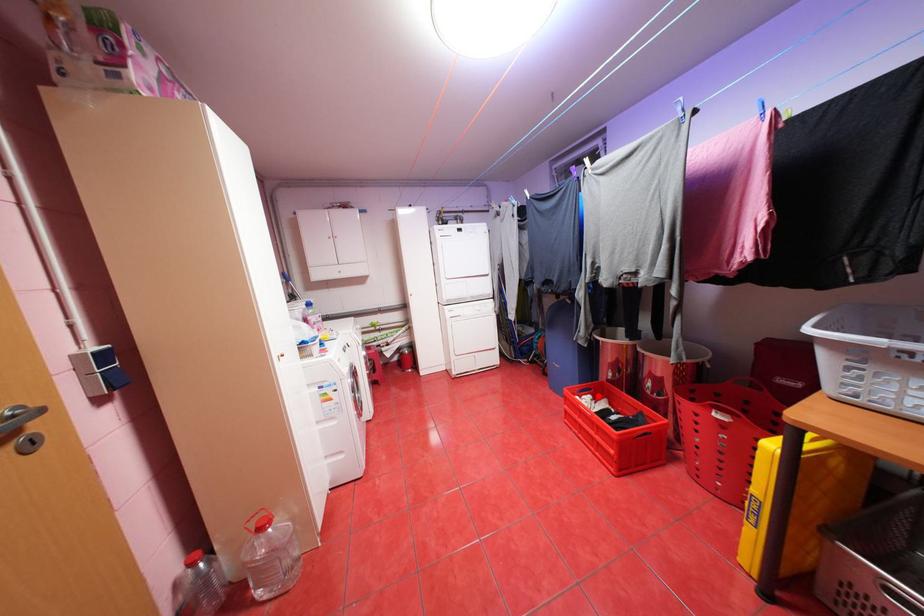
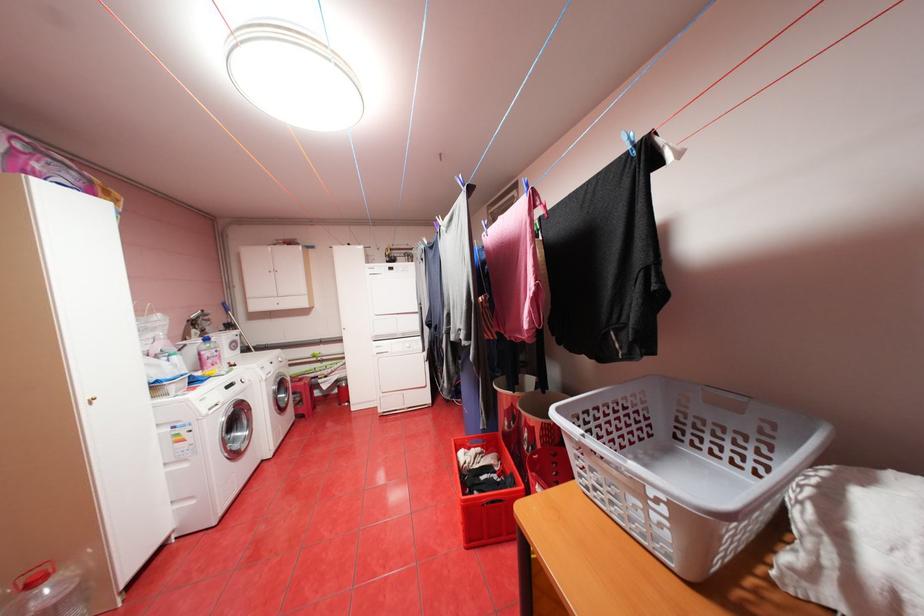
Question: I am providing you with two images of the same scene from different viewpoints. A red point is marked on the first image. At the location where the point appears in image 1, is it still visible in image 2?

Choices:
 (A) Yes
 (B) No

Answer: (A)